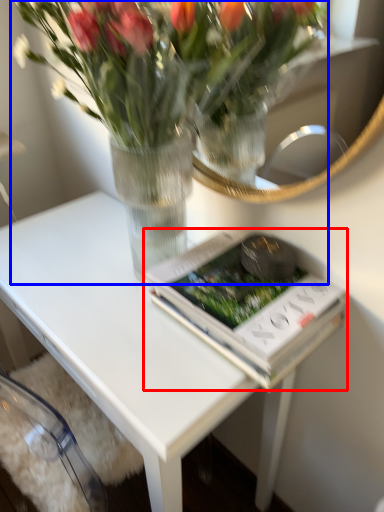
Question: Among these objects, which one is nearest to the camera, paperback book (highlighted by a red box) or houseplant (highlighted by a blue box)?

Choices:
 (A) paperback book
 (B) houseplant

Answer: (B)